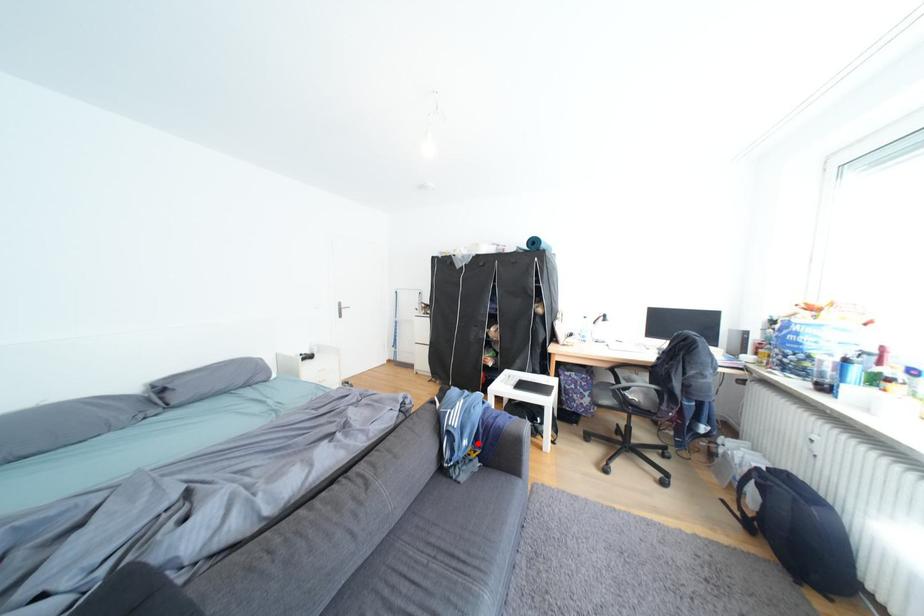
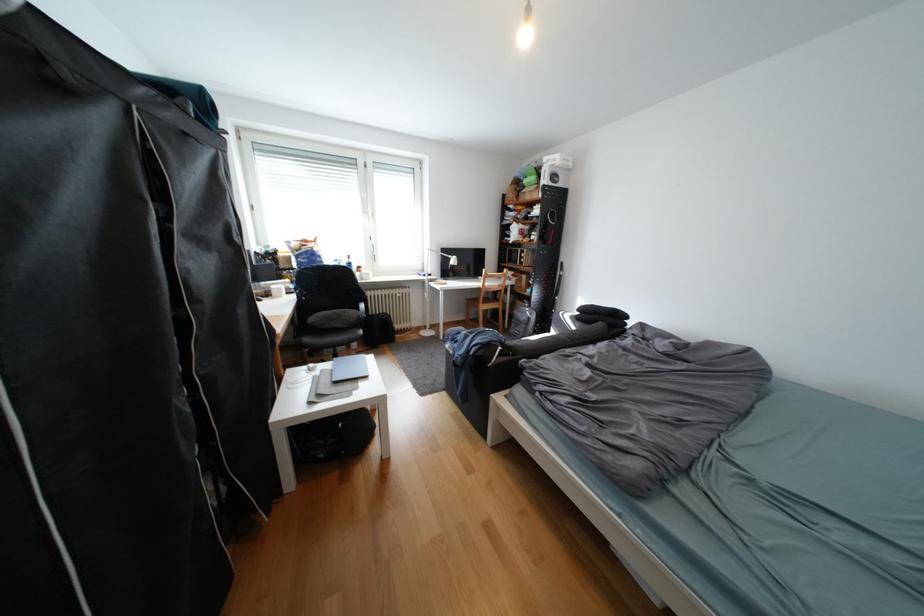
Question: I am providing you with two images of the same scene from different viewpoints. A red point is marked on the first image. Is the red point's position out of view in image 2?

Choices:
 (A) Yes
 (B) No

Answer: (A)